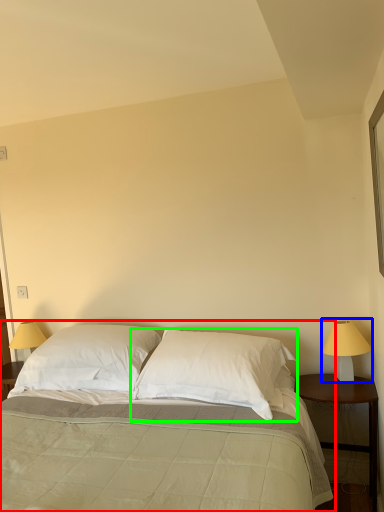
Question: Which object is the closest to the bed (highlighted by a red box)? Choose among these: bedside lamp (highlighted by a blue box) or pillow (highlighted by a green box).

Choices:
 (A) bedside lamp
 (B) pillow

Answer: (B)